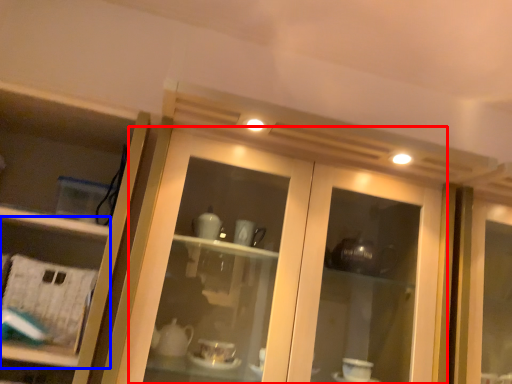
Question: Which point is further to the camera, door (highlighted by a red box) or shelf (highlighted by a blue box)?

Choices:
 (A) door
 (B) shelf

Answer: (B)